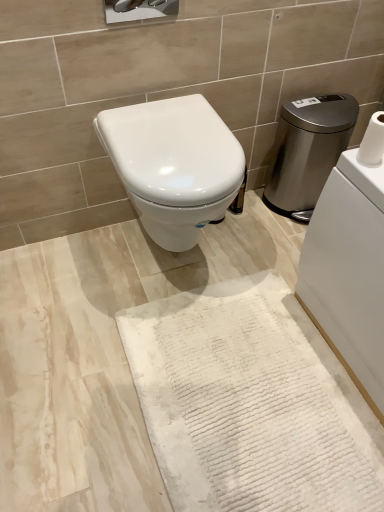
This screenshot has width=384, height=512. I want to click on free space below white glossy toilet at center (from a real-world perspective), so click(x=170, y=266).